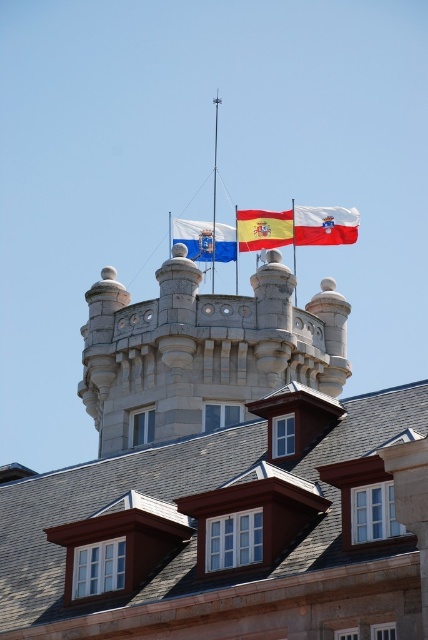
Question: Among these objects, which one is nearest to the camera?

Choices:
 (A) blue fabric flag at center
 (B) red fabric flag at upper center

Answer: (A)

Question: Which object is the closest to the brown shingles at upper center?

Choices:
 (A) red fabric flag at upper center
 (B) blue fabric flag at center

Answer: (B)

Question: Among these objects, which one is nearest to the camera?

Choices:
 (A) metallic flagpole at upper center
 (B) red fabric flag at upper center

Answer: (B)

Question: Is brown shingles at upper center thinner than blue fabric flag at center?

Choices:
 (A) yes
 (B) no

Answer: (B)

Question: Can you confirm if red fabric flag at center is positioned to the left of metallic flagpole at upper center?

Choices:
 (A) yes
 (B) no

Answer: (B)

Question: Does red fabric flag at center have a larger size compared to red fabric flag at upper center?

Choices:
 (A) yes
 (B) no

Answer: (A)